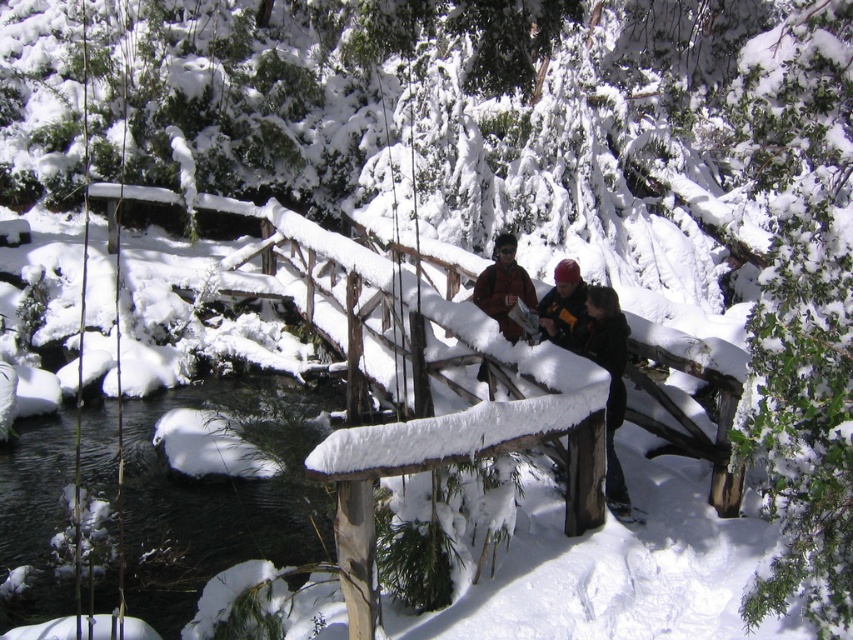
Question: Which is farther from the clear water at center?

Choices:
 (A) dark brown leather jacket at center
 (B) matte black helmet at center
 (C) black leather jacket at center

Answer: (C)

Question: Can you confirm if clear water at center is positioned to the left of dark brown leather jacket at center?

Choices:
 (A) no
 (B) yes

Answer: (B)

Question: Which point appears closest to the camera in this image?

Choices:
 (A) (596, 356)
 (B) (546, 301)
 (C) (149, 570)
 (D) (614, 328)

Answer: (D)

Question: Can you confirm if clear water at center is positioned below black leather jacket at center?

Choices:
 (A) no
 (B) yes

Answer: (B)

Question: Where is black leather jacket at center located in relation to matte black helmet at center in the image?

Choices:
 (A) left
 (B) right

Answer: (B)

Question: Estimate the real-world distances between objects in this image. Which object is farther from the clear water at center?

Choices:
 (A) black leather jacket at center
 (B) matte black helmet at center

Answer: (A)